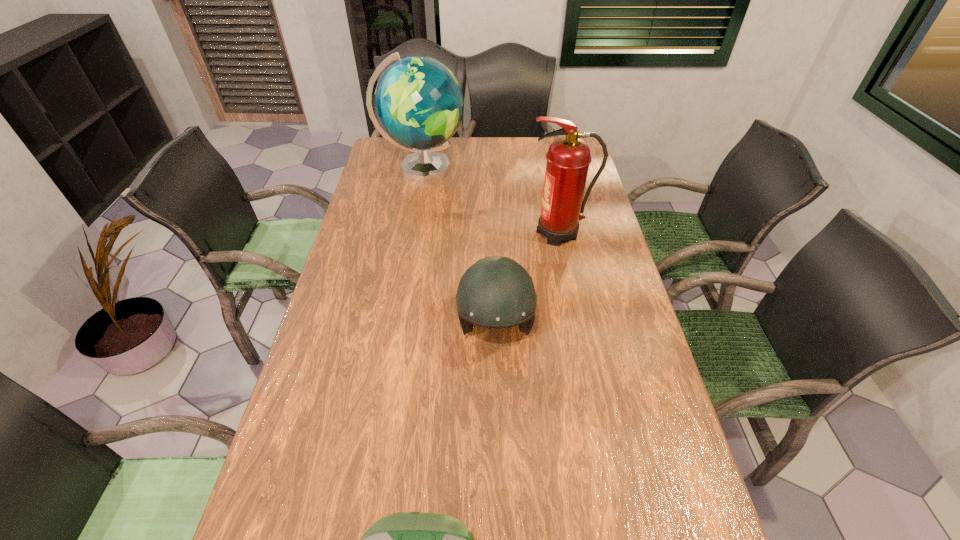
Where is `globe`? globe is located at coordinates (419, 104).

Where is `the second farthest object`? The width and height of the screenshot is (960, 540). the second farthest object is located at coordinates (568, 158).

This screenshot has width=960, height=540. I want to click on the rightmost object, so click(568, 158).

The width and height of the screenshot is (960, 540). In order to click on the farther football helmet in this screenshot , I will do `click(496, 292)`.

I want to click on free space located on the front surface of the globe, so click(545, 169).

Find the location of a particular element. vacant area situated 0.310m on the front-facing side of the third nearest object is located at coordinates (434, 233).

Identify the location of vacant space situated on the front-facing side of the third nearest object. tap(437, 233).

You are a GUI agent. You are given a task and a screenshot of the screen. Output one action in this format:
    pyautogui.click(x=<x>, y=<y>)
    Task: Click on the blank area located 0.050m on the front-facing side of the third nearest object
    
    Given the screenshot: What is the action you would take?
    pyautogui.click(x=511, y=233)

Where is `vacant area situated at the face opening of the third farthest object`? The height and width of the screenshot is (540, 960). vacant area situated at the face opening of the third farthest object is located at coordinates (499, 470).

The image size is (960, 540). I want to click on object situated at the far edge, so click(419, 104).